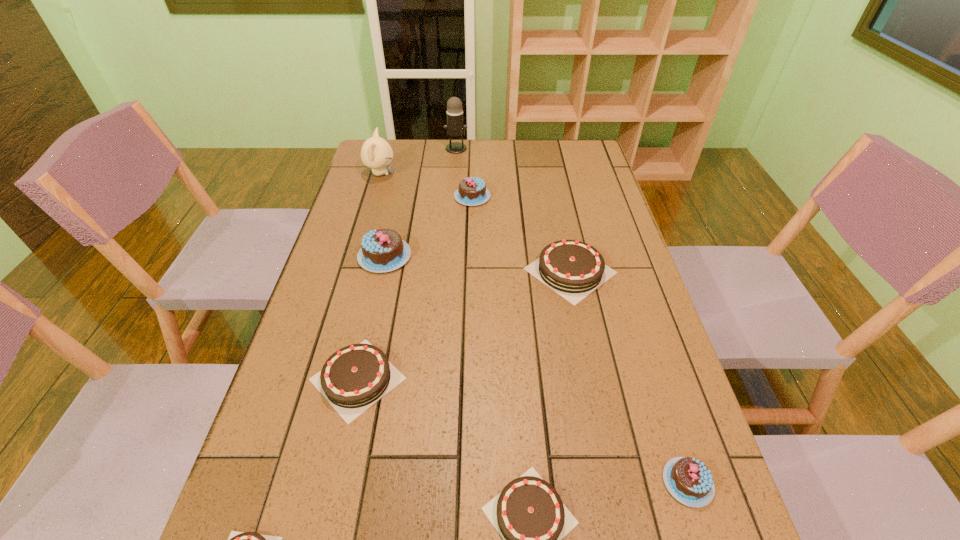
Locate an element on the screen. This screenshot has width=960, height=540. brown chocolate cake that stands as the closest to the shortest chocolate cake is located at coordinates point(355,377).

I want to click on brown chocolate cake that stands as the third closest to the second biggest brown chocolate cake, so click(x=573, y=269).

Where is `free space that satisfies the following two spatial constraints: 1. on the face of the eighth shortest object; 2. on the back side of the second farthest brown chocolate cake`? free space that satisfies the following two spatial constraints: 1. on the face of the eighth shortest object; 2. on the back side of the second farthest brown chocolate cake is located at coordinates (320, 379).

The image size is (960, 540). Find the location of `vacant space that satisfies the following two spatial constraints: 1. on the face of the farthest pink chocolate cake; 2. on the right side of the eighth shortest object`. vacant space that satisfies the following two spatial constraints: 1. on the face of the farthest pink chocolate cake; 2. on the right side of the eighth shortest object is located at coordinates (373, 197).

This screenshot has width=960, height=540. I want to click on free spot that satisfies the following two spatial constraints: 1. on the back side of the biggest brown chocolate cake; 2. on the face of the second farthest object, so click(x=550, y=173).